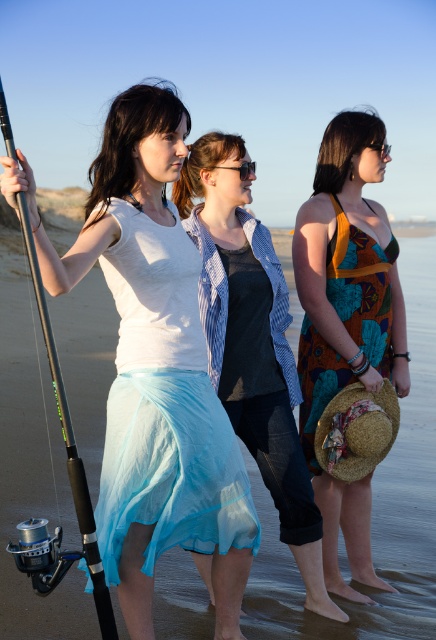
Question: Which object is closer to the camera taking this photo?

Choices:
 (A) blue sheer skirt at center
 (B) translucent blue skirt at center
 (C) multicolored printed fabric dress at center
 (D) floral print dress at center

Answer: (B)

Question: Does multicolored printed fabric dress at center have a greater width compared to silver metallic fishing pole at left?

Choices:
 (A) yes
 (B) no

Answer: (A)

Question: Can you confirm if matte white blouse at center is wider than floral print dress at center?

Choices:
 (A) yes
 (B) no

Answer: (A)

Question: Which object is positioned closest to the matte white blouse at center?

Choices:
 (A) translucent blue skirt at center
 (B) floral print dress at center
 (C) multicolored printed fabric dress at center

Answer: (A)

Question: Is translucent blue skirt at center further to the viewer compared to floral print dress at center?

Choices:
 (A) yes
 (B) no

Answer: (B)

Question: Which of the following is the closest to the observer?

Choices:
 (A) silver metallic fishing pole at left
 (B) blue sheer skirt at center
 (C) floral print dress at center
 (D) translucent blue skirt at center

Answer: (A)